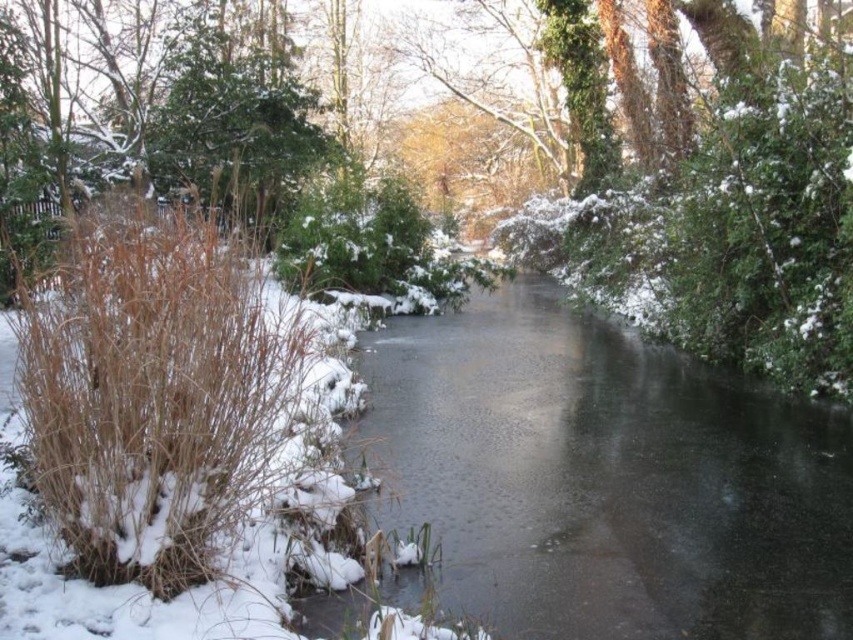
Question: Is frozen ice at center thinner than brown dry reed at left?

Choices:
 (A) no
 (B) yes

Answer: (A)

Question: Is frozen ice at center thinner than brown dry reed at left?

Choices:
 (A) no
 (B) yes

Answer: (A)

Question: Which point appears farthest from the camera in this image?

Choices:
 (A) (292, 456)
 (B) (819, 422)

Answer: (B)

Question: Does frozen ice at center have a greater width compared to brown dry reed at left?

Choices:
 (A) no
 (B) yes

Answer: (B)